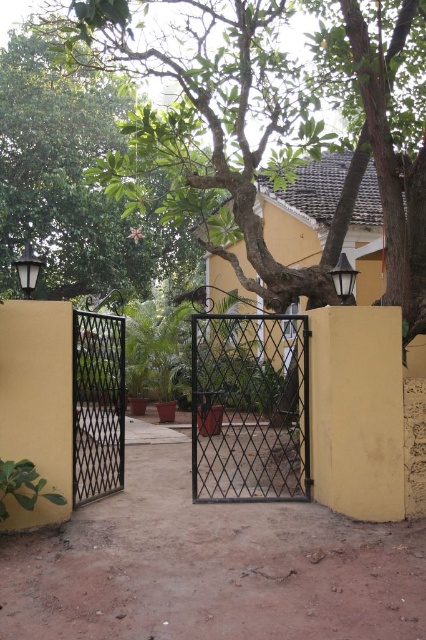
Does green leafy tree at center have a greater width compared to black metal gate at left?

Yes.

Is point (126, 60) positioned behind point (101, 433)?

That is True.

Between point (377, 92) and point (115, 435), which one is positioned behind?

The point (115, 435) is behind.

Image resolution: width=426 pixels, height=640 pixels. Find the location of `green leafy tree at center`. green leafy tree at center is located at coordinates (278, 120).

Can you confirm if green leafy tree at center is positioned to the right of black wrought iron gate at center?

Answer: Indeed, green leafy tree at center is positioned on the right side of black wrought iron gate at center.

Can you confirm if green leafy tree at center is thinner than black wrought iron gate at center?

Correct, green leafy tree at center's width is less than black wrought iron gate at center's.

The height and width of the screenshot is (640, 426). What do you see at coordinates (278, 120) in the screenshot?
I see `green leafy tree at center` at bounding box center [278, 120].

Image resolution: width=426 pixels, height=640 pixels. I want to click on green leafy tree at center, so click(278, 120).

The width and height of the screenshot is (426, 640). What do you see at coordinates (250, 406) in the screenshot? I see `black wrought iron gate at center` at bounding box center [250, 406].

Does black wrought iron gate at center have a lesser height compared to black metal gate at left?

In fact, black wrought iron gate at center may be taller than black metal gate at left.

Is point (270, 372) positioned after point (94, 332)?

Yes.

Find the location of a particular element. The width and height of the screenshot is (426, 640). black wrought iron gate at center is located at coordinates (250, 406).